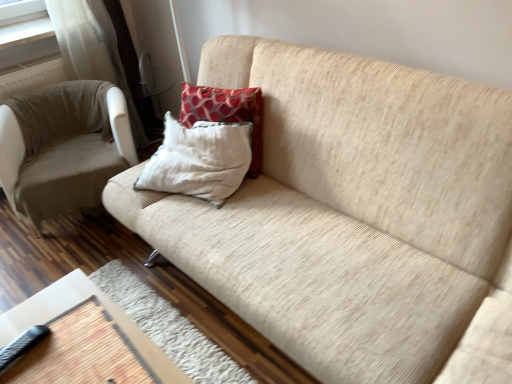
Locate an element on the screen. The image size is (512, 384). free space behind black rubberized remote at lower left is located at coordinates (42, 329).